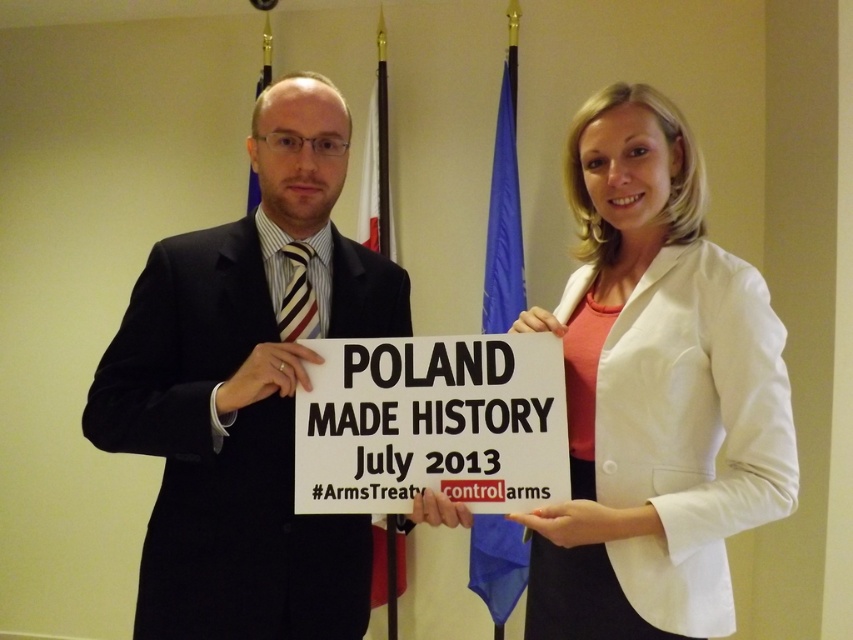
Question: Which object is the closest to the white matte blazer at center?

Choices:
 (A) black suit at center
 (B) white paper sign at center

Answer: (B)

Question: Is white matte blazer at center positioned in front of black suit at center?

Choices:
 (A) yes
 (B) no

Answer: (A)

Question: Which object appears closest to the camera in this image?

Choices:
 (A) black suit at center
 (B) white paper sign at center

Answer: (B)

Question: Observing the image, what is the correct spatial positioning of white matte blazer at center in reference to black suit at center?

Choices:
 (A) right
 (B) left

Answer: (A)

Question: Among these points, which one is nearest to the camera?

Choices:
 (A) (556, 346)
 (B) (270, 476)

Answer: (A)

Question: Is white matte blazer at center smaller than black suit at center?

Choices:
 (A) no
 (B) yes

Answer: (B)